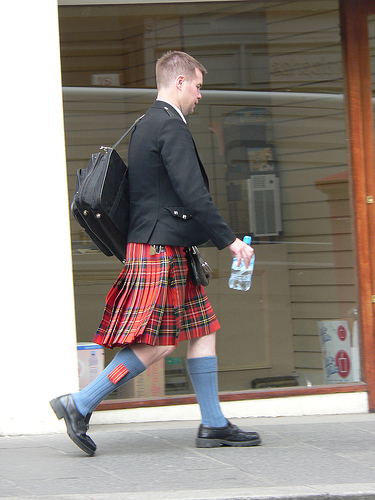
In order to click on window in this screenshot , I will do `click(246, 148)`.